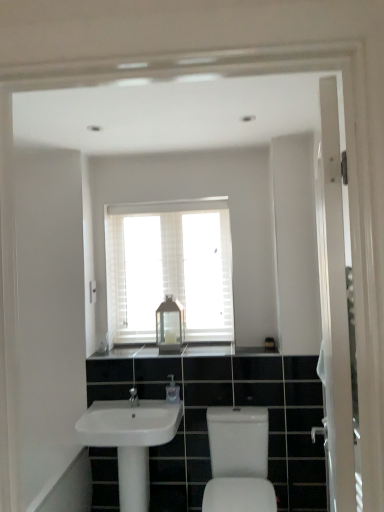
From the picture: Measure the distance between black granite countertop at center and camera.

The depth of black granite countertop at center is 8.35 feet.

Where is `matte silver tap at center`? This screenshot has width=384, height=512. matte silver tap at center is located at coordinates (133, 397).

What is the approximate width of white wooden window at center?

3.29 inches.

The image size is (384, 512). I want to click on white glossy sink at lower left, acting as the 1th sink starting from the left, so click(x=129, y=423).

In order to face white glossy sink at lower center, placed as the 1th sink when sorted from right to left, should I rotate leftwards or rightwards?

Turn right by 6.335 degrees to look at white glossy sink at lower center, placed as the 1th sink when sorted from right to left.

You are a GUI agent. You are given a task and a screenshot of the screen. Output one action in this format:
    pyautogui.click(x=<x>, y=<y>)
    Task: Click on the black granite countertop at center
    
    Given the screenshot: What is the action you would take?
    pyautogui.click(x=226, y=350)

Who is bigger, black granite countertop at center or clear plastic soap dispenser at center?

black granite countertop at center.

From the image's perspective, is black granite countertop at center above clear plastic soap dispenser at center?

Indeed, from the image's perspective, black granite countertop at center is shown above clear plastic soap dispenser at center.

Locate an element on the screen. The height and width of the screenshot is (512, 384). counter top above the clear plastic soap dispenser at center (from the image's perspective) is located at coordinates 226,350.

Considering the sizes of objects black granite countertop at center and clear plastic soap dispenser at center in the image provided, who is thinner, black granite countertop at center or clear plastic soap dispenser at center?

With smaller width is clear plastic soap dispenser at center.

Who is smaller, white glossy screen door at right or metallic glass lantern at center?

metallic glass lantern at center.

Could you tell me if white glossy screen door at right is turned towards metallic glass lantern at center?

No, white glossy screen door at right is not turned towards metallic glass lantern at center.

In terms of height, does white glossy screen door at right look taller or shorter compared to metallic glass lantern at center?

Considering their sizes, white glossy screen door at right has more height than metallic glass lantern at center.

I want to click on medicine cabinet behind the white glossy screen door at right, so click(x=170, y=326).

Between white wooden window at center and metallic glass lantern at center, which one has larger size?

With larger size is white wooden window at center.

Is white wooden window at center beside metallic glass lantern at center?

No.

Is white wooden window at center taller or shorter than metallic glass lantern at center?

Considering their sizes, white wooden window at center has more height than metallic glass lantern at center.

In terms of width, does black granite countertop at center look wider or thinner when compared to matte silver tap at center?

In the image, black granite countertop at center appears to be wider than matte silver tap at center.

From their relative heights in the image, would you say black granite countertop at center is taller or shorter than matte silver tap at center?

In the image, black granite countertop at center appears to be shorter than matte silver tap at center.

Which is correct: black granite countertop at center is inside matte silver tap at center, or outside of it?

black granite countertop at center is not enclosed by matte silver tap at center.

From the image's perspective, is black granite countertop at center on matte silver tap at center?

Indeed, from the image's perspective, black granite countertop at center is shown above matte silver tap at center.

Would you say matte silver tap at center is a long distance from white glossy screen door at right?

Yes, matte silver tap at center and white glossy screen door at right are quite far apart.

Is matte silver tap at center to the right of white glossy screen door at right from the viewer's perspective?

In fact, matte silver tap at center is to the left of white glossy screen door at right.

Considering the sizes of objects matte silver tap at center and white glossy screen door at right in the image provided, who is thinner, matte silver tap at center or white glossy screen door at right?

white glossy screen door at right is thinner.

Which of these two, matte silver tap at center or white glossy screen door at right, stands taller?

Standing taller between the two is white glossy screen door at right.

From the image's perspective, is matte silver tap at center on top of black granite countertop at center?

No.

Considering the relative sizes of matte silver tap at center and black granite countertop at center in the image provided, is matte silver tap at center wider than black granite countertop at center?

Incorrect, the width of matte silver tap at center does not surpass that of black granite countertop at center.

Based on their positions, is matte silver tap at center located to the left or right of black granite countertop at center?

matte silver tap at center is to the left of black granite countertop at center.

How much distance is there between matte silver tap at center and black granite countertop at center?

15.81 inches.

Would you say white glossy screen door at right is a long distance from white glossy sink at lower center, placed as the 1th sink when sorted from right to left?

white glossy screen door at right is far away from white glossy sink at lower center, placed as the 1th sink when sorted from right to left.

From the picture: Is white glossy screen door at right closer to the viewer compared to white glossy sink at lower center, placed as the 1th sink when sorted from right to left?

Yes, white glossy screen door at right is in front of white glossy sink at lower center, placed as the 1th sink when sorted from right to left.

From the image's perspective, does white glossy screen door at right appear lower than white glossy sink at lower center, placed as the 1th sink when sorted from right to left?

No.

From a real-world perspective, is white glossy screen door at right located higher than white glossy sink at lower center, placed as the 1th sink when sorted from right to left?

Yes.

Find the location of a particular element. counter top above the clear plastic soap dispenser at center (from the image's perspective) is located at coordinates (226, 350).

The image size is (384, 512). In order to click on screen door that appears in front of the metallic glass lantern at center in this screenshot , I will do (334, 305).

Which object lies further to the anchor point black granite countertop at center, metallic glass lantern at center or matte silver tap at center?

Among the two, matte silver tap at center is located further to black granite countertop at center.

In the scene shown: Considering their positions, is black granite countertop at center positioned further to clear plastic soap dispenser at center than metallic glass lantern at center?

Among the two, metallic glass lantern at center is located further to clear plastic soap dispenser at center.

Considering their positions, is matte silver tap at center positioned closer to metallic glass lantern at center than black granite countertop at center?

Among the two, black granite countertop at center is located nearer to metallic glass lantern at center.

Estimate the real-world distances between objects in this image. Which object is closer to white glossy sink at lower left, acting as the 1th sink starting from the left, clear plastic soap dispenser at center or white wooden window at center?

clear plastic soap dispenser at center.

Based on their spatial positions, is black granite countertop at center or white glossy sink at lower left, which is counted as the 2th sink, starting from the right, further from clear plastic soap dispenser at center?

The object further to clear plastic soap dispenser at center is black granite countertop at center.

Estimate the real-world distances between objects in this image. Which object is closer to white glossy sink at lower left, which is counted as the 2th sink, starting from the right, metallic glass lantern at center or white glossy sink at lower center, acting as the 2th sink starting from the left?

white glossy sink at lower center, acting as the 2th sink starting from the left, is positioned closer to the anchor white glossy sink at lower left, which is counted as the 2th sink, starting from the right.

Looking at the image, which one is located closer to white glossy screen door at right, white wooden window at center or white glossy sink at lower left, which is counted as the 2th sink, starting from the right?

Among the two, white glossy sink at lower left, which is counted as the 2th sink, starting from the right, is located nearer to white glossy screen door at right.

Estimate the real-world distances between objects in this image. Which object is closer to white glossy screen door at right, white glossy sink at lower center, acting as the 2th sink starting from the left, or white glossy sink at lower left, which is counted as the 2th sink, starting from the right?

white glossy sink at lower center, acting as the 2th sink starting from the left, is positioned closer to the anchor white glossy screen door at right.

Image resolution: width=384 pixels, height=512 pixels. I want to click on medicine cabinet between white wooden window at center and black granite countertop at center in the vertical direction, so click(170, 326).

Find the location of a particular element. This screenshot has height=512, width=384. medicine cabinet that lies between white wooden window at center and matte silver tap at center from top to bottom is located at coordinates (170, 326).

Locate an element on the screen. This screenshot has width=384, height=512. medicine cabinet positioned between white glossy screen door at right and white wooden window at center from near to far is located at coordinates (170, 326).

Where is `counter top between white wooden window at center and white glossy sink at lower left, which is counted as the 2th sink, starting from the right, vertically`? counter top between white wooden window at center and white glossy sink at lower left, which is counted as the 2th sink, starting from the right, vertically is located at coordinates (226, 350).